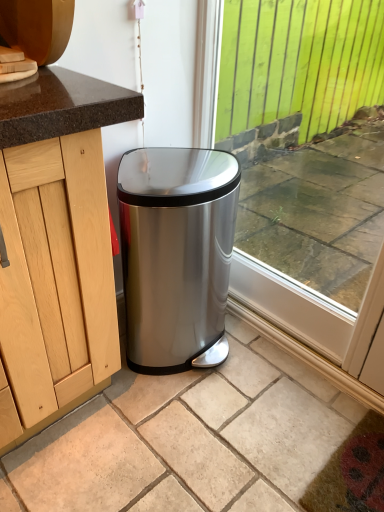
Question: From the image's perspective, does transparent glass window at center appear lower than satin metallic trash can at lower center?

Choices:
 (A) no
 (B) yes

Answer: (A)

Question: Can you confirm if transparent glass window at center is bigger than satin metallic trash can at lower center?

Choices:
 (A) no
 (B) yes

Answer: (B)

Question: Would you say transparent glass window at center contains satin metallic trash can at lower center?

Choices:
 (A) yes
 (B) no

Answer: (B)

Question: Are transparent glass window at center and satin metallic trash can at lower center beside each other?

Choices:
 (A) yes
 (B) no

Answer: (B)

Question: Is transparent glass window at center to the left of satin metallic trash can at lower center from the viewer's perspective?

Choices:
 (A) yes
 (B) no

Answer: (B)

Question: Is transparent glass window at center thinner than satin metallic trash can at lower center?

Choices:
 (A) no
 (B) yes

Answer: (B)

Question: Is satin metallic trash can at lower center placed right next to transparent glass window at center?

Choices:
 (A) yes
 (B) no

Answer: (B)

Question: Could you tell me if satin metallic trash can at lower center is turned towards transparent glass window at center?

Choices:
 (A) yes
 (B) no

Answer: (B)

Question: Can you confirm if satin metallic trash can at lower center is positioned to the right of transparent glass window at center?

Choices:
 (A) yes
 (B) no

Answer: (B)

Question: Is satin metallic trash can at lower center taller than transparent glass window at center?

Choices:
 (A) yes
 (B) no

Answer: (B)

Question: From the image's perspective, is satin metallic trash can at lower center on transparent glass window at center?

Choices:
 (A) no
 (B) yes

Answer: (A)

Question: Is satin metallic trash can at lower center further to camera compared to transparent glass window at center?

Choices:
 (A) yes
 (B) no

Answer: (B)

Question: Is satin metallic trash can at lower center in front of or behind transparent glass window at center in the image?

Choices:
 (A) behind
 (B) front

Answer: (B)